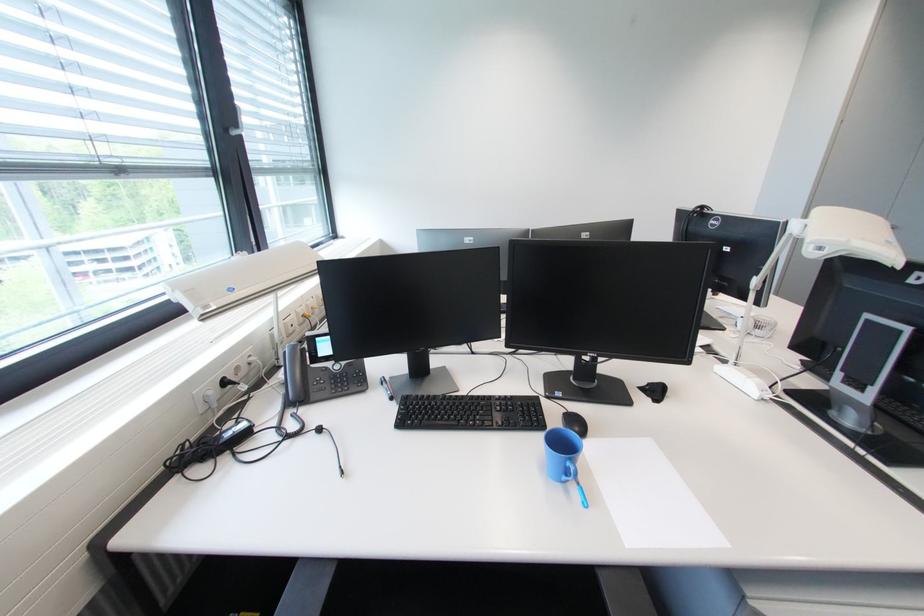
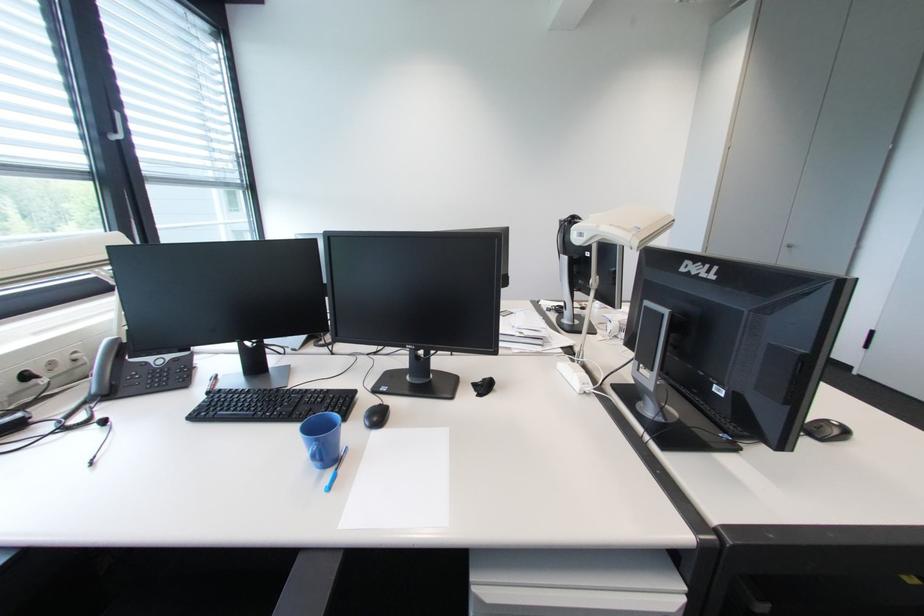
Question: In a continuous first-person perspective shot, in which direction is the camera moving?

Choices:
 (A) Left
 (B) Right
 (C) Forward
 (D) Backward

Answer: (B)